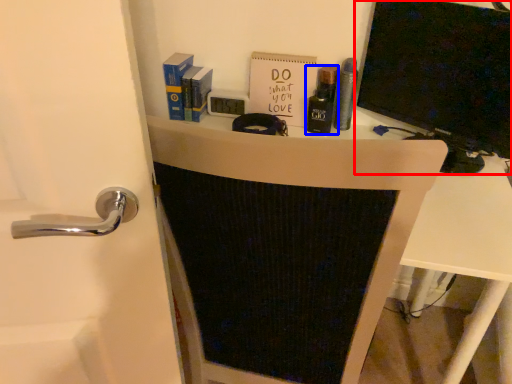
Question: Which point is further to the camera, wide (highlighted by a red box) or toiletry (highlighted by a blue box)?

Choices:
 (A) wide
 (B) toiletry

Answer: (B)